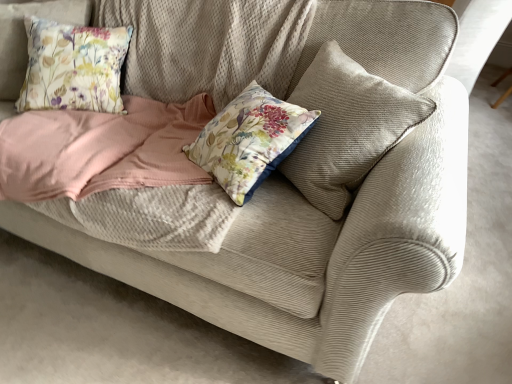
Image resolution: width=512 pixels, height=384 pixels. Describe the element at coordinates (73, 67) in the screenshot. I see `floral fabric cushion at upper left` at that location.

The width and height of the screenshot is (512, 384). What are the coordinates of `floral fabric cushion at upper left` in the screenshot? It's located at (73, 67).

Locate an element on the screen. The image size is (512, 384). floral fabric cushion at upper left is located at coordinates (73, 67).